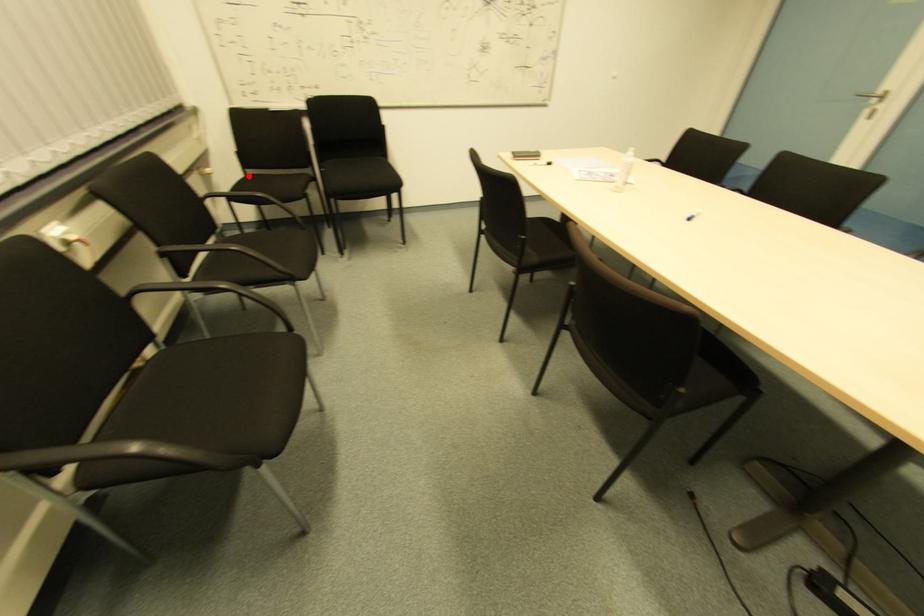
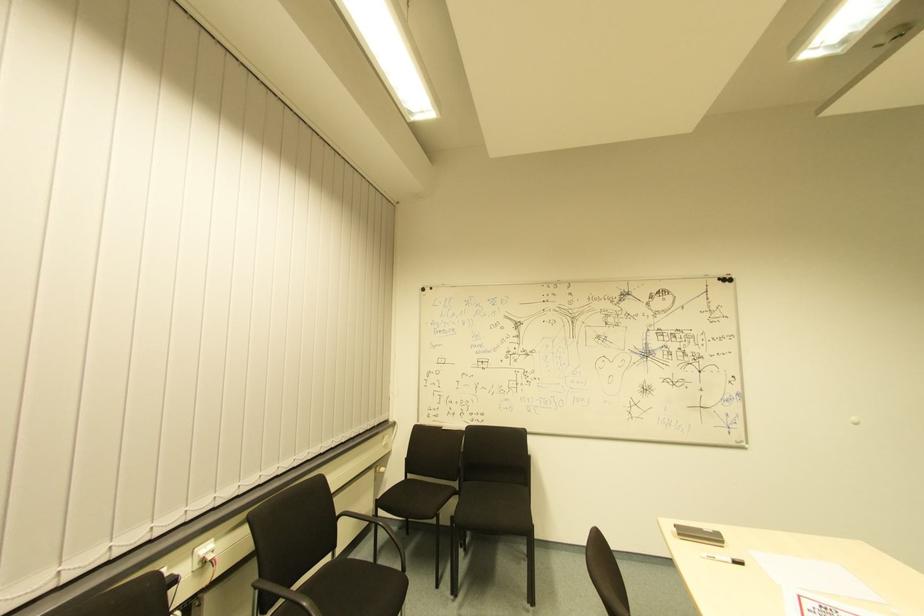
The point at the highlighted location is marked in the first image. Where is the corresponding point in the second image?

(408, 479)